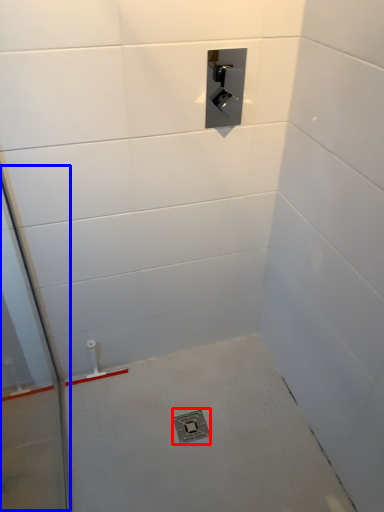
Question: Which object appears closest to the camera in this image, drain (highlighted by a red box) or glass door (highlighted by a blue box)?

Choices:
 (A) drain
 (B) glass door

Answer: (B)